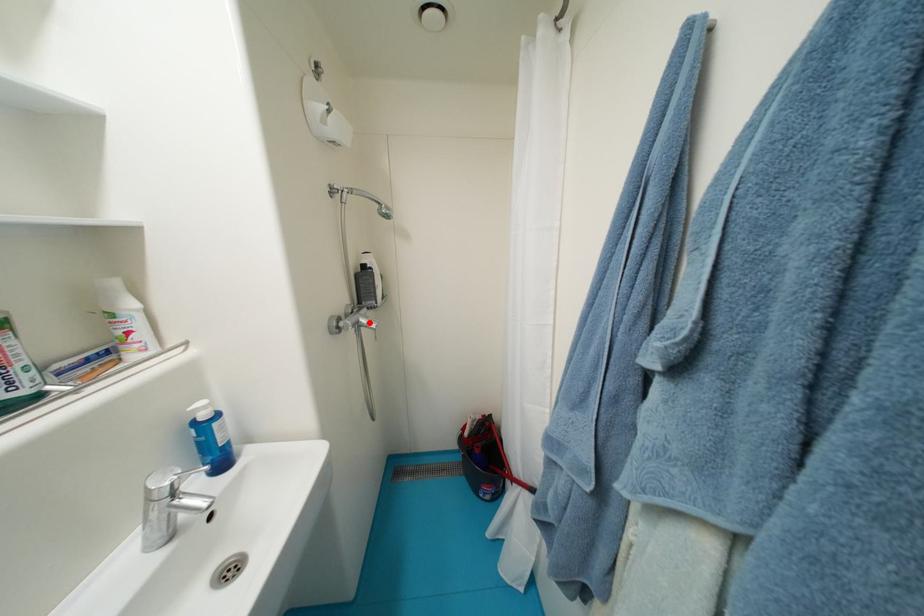
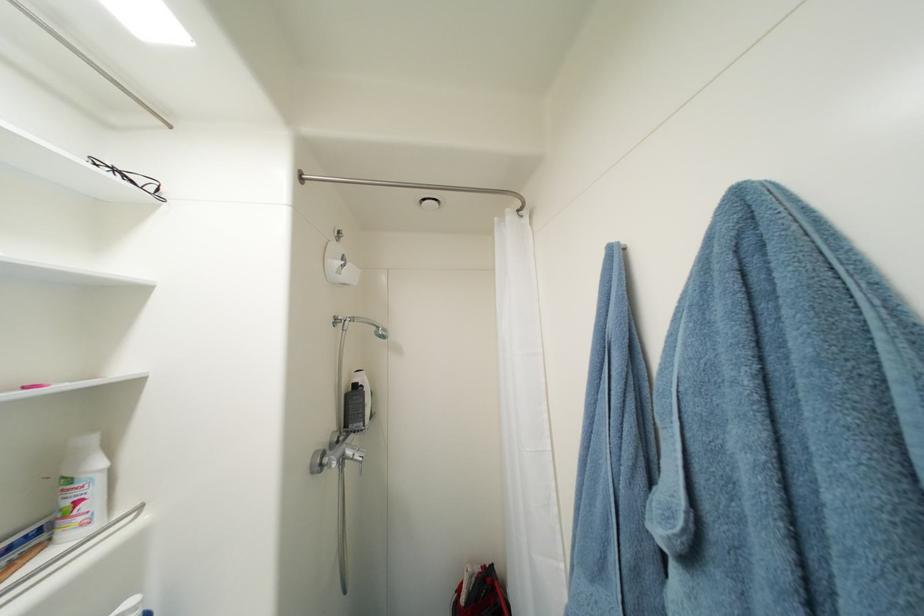
In the second image, find the point that corresponds to the highlighted location in the first image.

(356, 454)